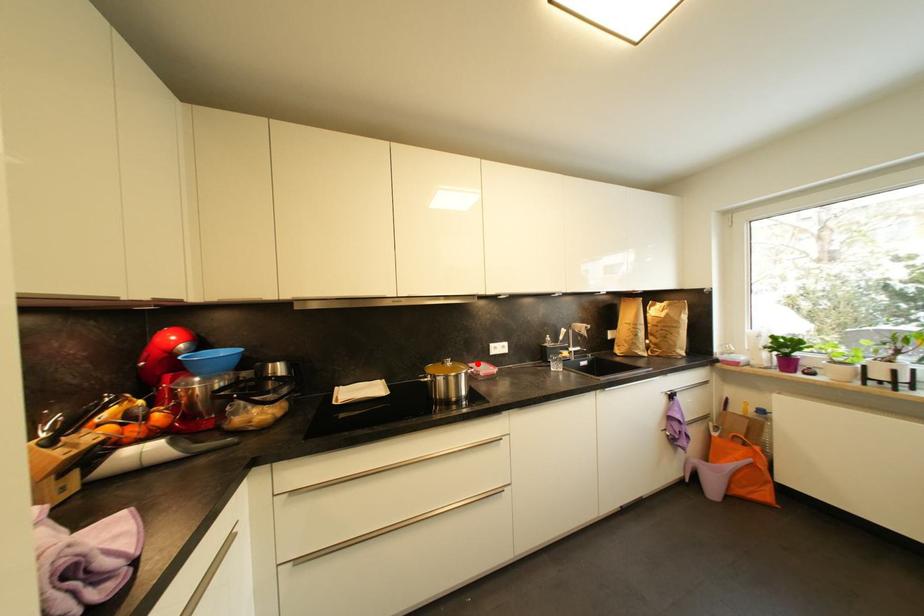
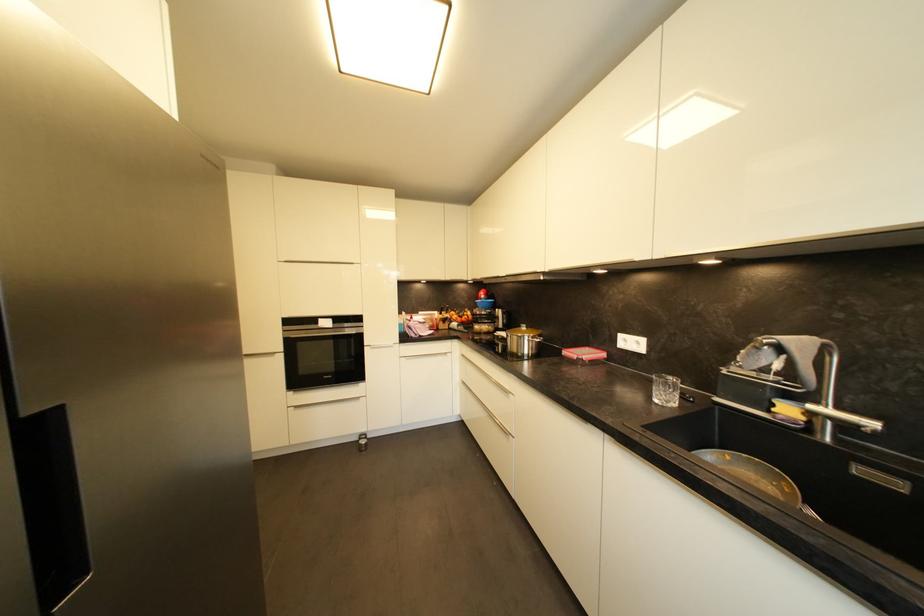
Locate, in the second image, the point that corresponds to the highlighted location in the first image.

(602, 350)